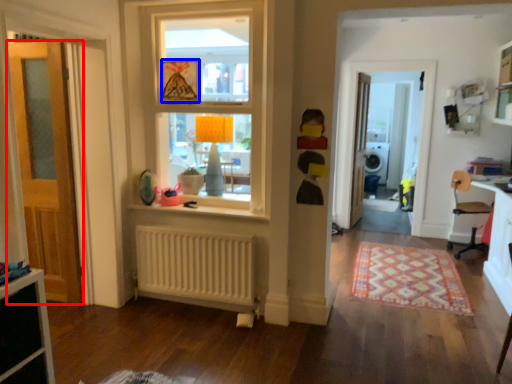
Question: Which object appears farthest to the camera in this image, door (highlighted by a red box) or picture frame (highlighted by a blue box)?

Choices:
 (A) door
 (B) picture frame

Answer: (B)